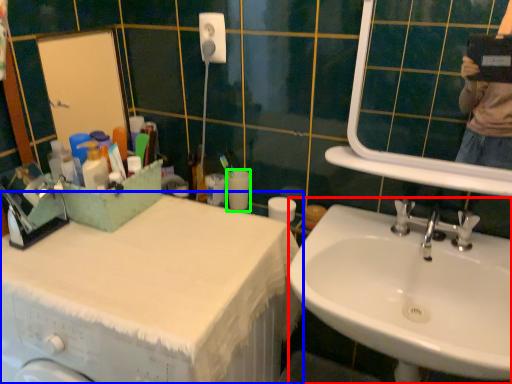
Question: Which object is positioned closest to sink (highlighted by a red box)? Select from counter top (highlighted by a blue box) and toilet paper (highlighted by a green box).

Choices:
 (A) counter top
 (B) toilet paper

Answer: (A)